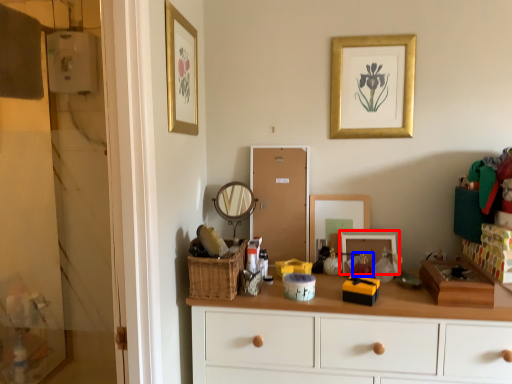
Question: Among these objects, which one is farthest to the camera, picture frame (highlighted by a red box) or toy (highlighted by a blue box)?

Choices:
 (A) picture frame
 (B) toy

Answer: (A)